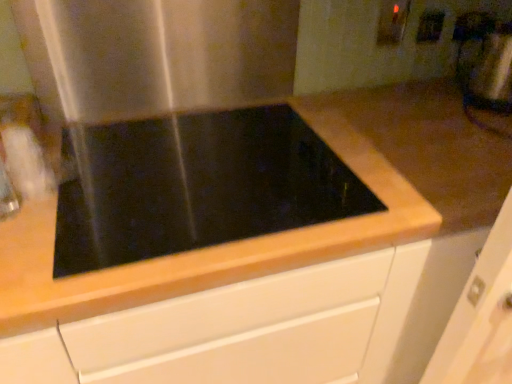
The height and width of the screenshot is (384, 512). In order to click on free space that is in between metallic silver blender at upper right and stainless steel at upper left in this screenshot , I will do `click(378, 101)`.